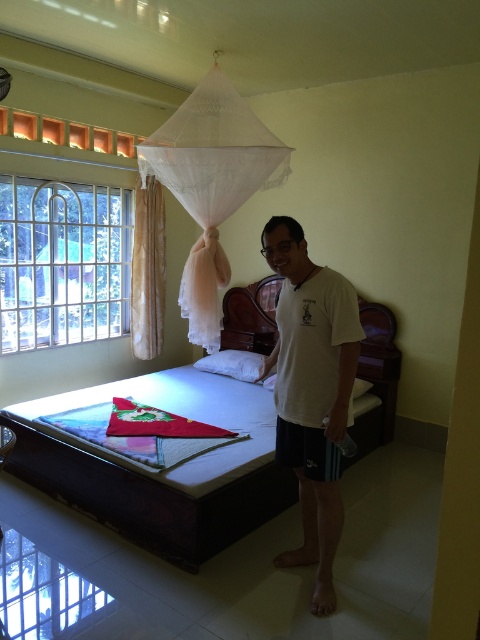
Is white sheer mosquito net at upper center closer to camera compared to white soft pillow at right?

That is True.

Identify the location of white sheer mosquito net at upper center. (211, 184).

Is point (186, 179) farther from viewer compared to point (363, 392)?

No, (186, 179) is closer to viewer.

This screenshot has height=640, width=480. Find the location of `white sheer mosquito net at upper center`. white sheer mosquito net at upper center is located at coordinates (211, 184).

Can you confirm if white sheer curtain at left is positioned to the right of white soft pillow at right?

No, white sheer curtain at left is not to the right of white soft pillow at right.

Which is above, white sheer curtain at left or white soft pillow at right?

white sheer curtain at left is above.

Who is more distant from viewer, (155,272) or (358,392)?

The point (155,272) is behind.

Locate an element on the screen. Image resolution: width=480 pixels, height=640 pixels. white sheer curtain at left is located at coordinates (147, 269).

Which is more to the right, clear glass window at left or white sheer curtain at left?

From the viewer's perspective, white sheer curtain at left appears more on the right side.

Does clear glass window at left come behind white sheer curtain at left?

No, clear glass window at left is closer to the viewer.

This screenshot has width=480, height=640. Describe the element at coordinates (62, 262) in the screenshot. I see `clear glass window at left` at that location.

The width and height of the screenshot is (480, 640). I want to click on clear glass window at left, so click(x=62, y=262).